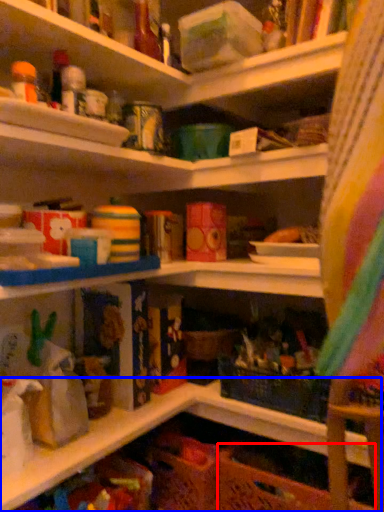
Question: Which point is closer to the camera, basket (highlighted by a red box) or shelf (highlighted by a blue box)?

Choices:
 (A) basket
 (B) shelf

Answer: (B)